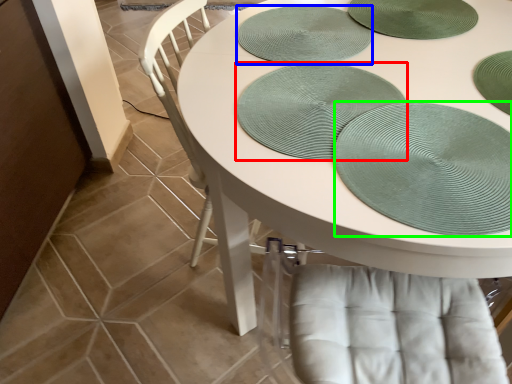
Question: Based on their relative distances, which object is farther from platter (highlighted by a red box)? Choose from platter (highlighted by a blue box) and glass plate (highlighted by a green box).

Choices:
 (A) platter
 (B) glass plate

Answer: (A)